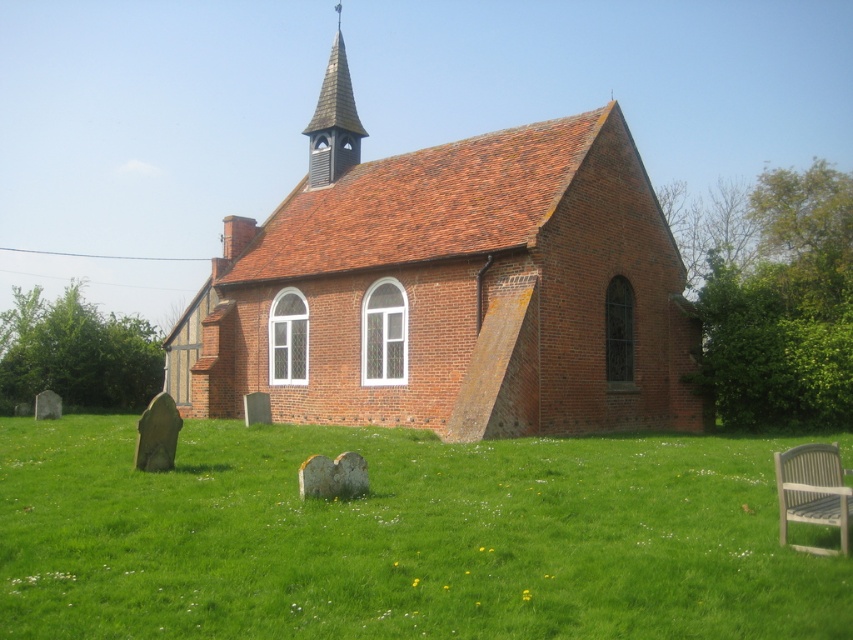
You are planning to place a new flower pot that is 1 meter wide in the area between the green grass at lower center and the light gray plastic chair at lower right. Based on the scene, will the flower pot fit in that space?

The green grass at lower center might be wider than the light gray plastic chair at lower right, so the space between them could accommodate a 1 meter wide flower pot.

You are standing at the point marked as point (401, 538) in the image. Looking towards the church, which direction should you walk to reach the green grass at lower center?

The point (401, 538) is already located on the green grass at lower center, so you are already there.